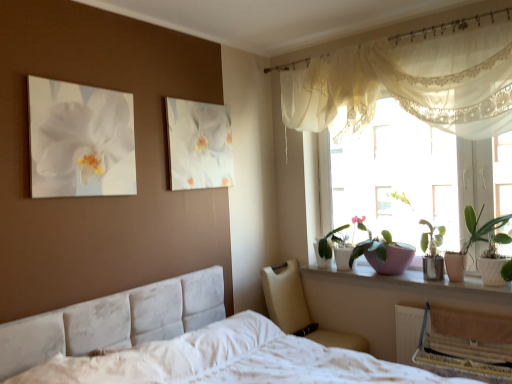
Question: Considering the positions of translucent fabric at upper right and white glossy canvas at upper center in the image, is translucent fabric at upper right taller or shorter than white glossy canvas at upper center?

Choices:
 (A) short
 (B) tall

Answer: (B)

Question: Considering the positions of translucent fabric at upper right and white glossy canvas at upper center in the image, is translucent fabric at upper right wider or thinner than white glossy canvas at upper center?

Choices:
 (A) wide
 (B) thin

Answer: (A)

Question: Which of these objects is positioned farthest from the sheer white curtain at upper right?

Choices:
 (A) pink matte pot at window
 (B) white glossy bowl at upper right
 (C) translucent fabric at upper right
 (D) white glossy orchid at upper left
 (E) green glossy leafy plant at window, the 1th houseplant from the back

Answer: (D)

Question: Which object is positioned farthest from the green glossy plant at right, the 1th houseplant in the front-to-back sequence?

Choices:
 (A) white glossy canvas at upper center
 (B) translucent fabric at upper right
 (C) sheer white curtain at upper right
 (D) green glossy leafy plant at window, acting as the first houseplant starting from the left
 (E) white fabric bed at lower center

Answer: (A)